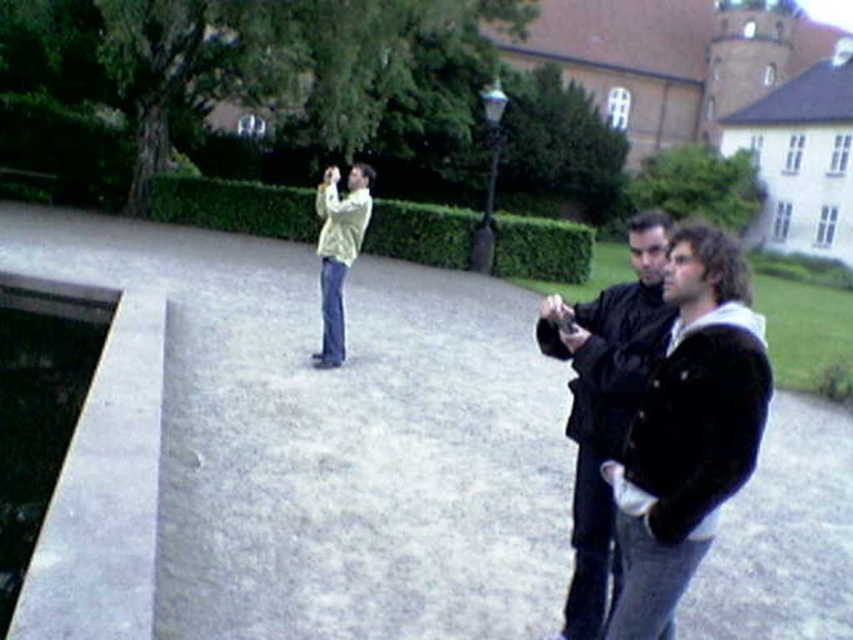
Which is behind, point (672, 460) or point (579, 225)?

Point (579, 225)

Does black velvet jacket at center have a larger size compared to green leafy hedge at center?

Incorrect, black velvet jacket at center is not larger than green leafy hedge at center.

You are a GUI agent. You are given a task and a screenshot of the screen. Output one action in this format:
    pyautogui.click(x=<x>, y=<y>)
    Task: Click on the black velvet jacket at center
    The image size is (853, 640).
    Given the screenshot: What is the action you would take?
    pyautogui.click(x=688, y=429)

Can you confirm if black velvet jacket at center is positioned to the left of green leafy hedge at upper center?

Yes, black velvet jacket at center is to the left of green leafy hedge at upper center.

I want to click on black velvet jacket at center, so click(x=688, y=429).

Between green leafy hedge at center and green leafy hedge at upper center, which one has more height?

With more height is green leafy hedge at upper center.

Which is behind, point (496, 266) or point (762, 193)?

Positioned behind is point (762, 193).

Which is behind, point (401, 209) or point (664, 196)?

Positioned behind is point (664, 196).

Locate an element on the screen. green leafy hedge at center is located at coordinates (236, 205).